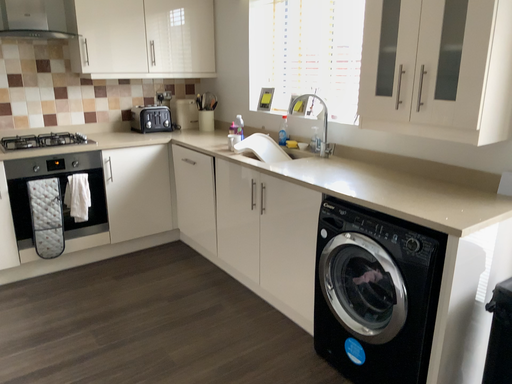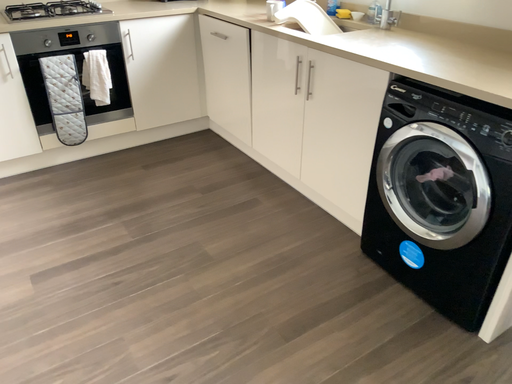
Question: Which way did the camera rotate in the video?

Choices:
 (A) rotated upward
 (B) rotated downward

Answer: (B)